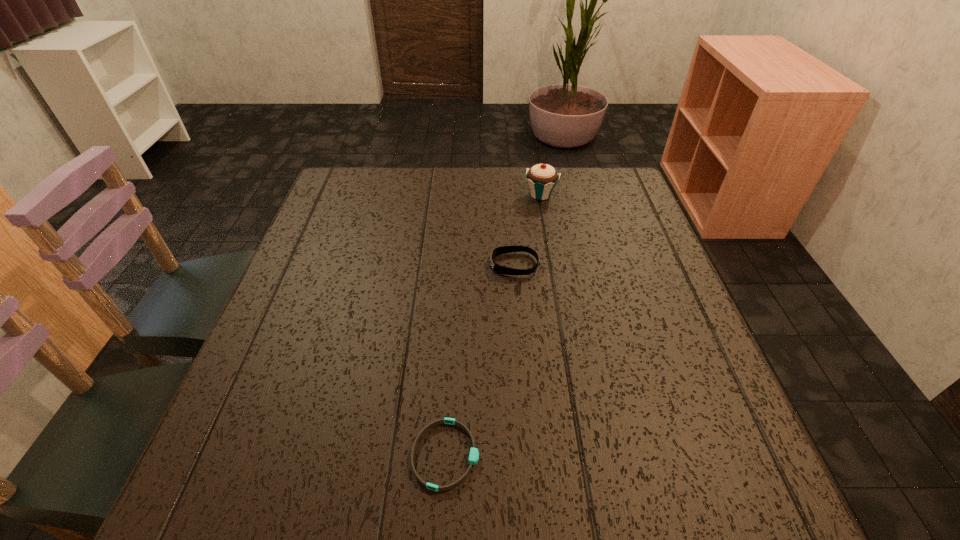
This screenshot has width=960, height=540. What are the coordinates of `free area in between the second farthest object and the shorter wristband` in the screenshot? It's located at (480, 360).

Where is `free spot between the leftmost object and the farthest object`? The width and height of the screenshot is (960, 540). free spot between the leftmost object and the farthest object is located at coordinates (493, 325).

This screenshot has height=540, width=960. I want to click on vacant area that lies between the farther wristband and the shortest object, so click(480, 360).

Locate an element on the screen. The width and height of the screenshot is (960, 540). free space between the shortest object and the second tallest object is located at coordinates (480, 360).

The image size is (960, 540). What are the coordinates of `free space that is in between the tallest object and the shortest object` in the screenshot? It's located at (493, 325).

Identify the location of empty space between the cupcake and the farther wristband. (527, 230).

The image size is (960, 540). I want to click on empty location between the left wristband and the tallest object, so click(493, 325).

At what (x,y) coordinates should I click in order to perform the action: click on vacant area between the second shortest object and the left wristband. Please return your answer as a coordinate pair (x, y). Image resolution: width=960 pixels, height=540 pixels. Looking at the image, I should click on (480, 360).

Identify the location of free space between the farther wristband and the farthest object. (527, 230).

Locate an element on the screen. This screenshot has width=960, height=540. vacant area between the taller wristband and the shorter wristband is located at coordinates (480, 360).